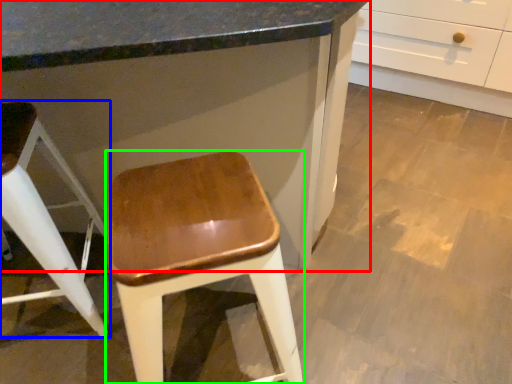
Question: Considering the real-world distances, which object is closest to cabinetry (highlighted by a red box)? stool (highlighted by a blue box) or stool (highlighted by a green box).

Choices:
 (A) stool
 (B) stool

Answer: (B)